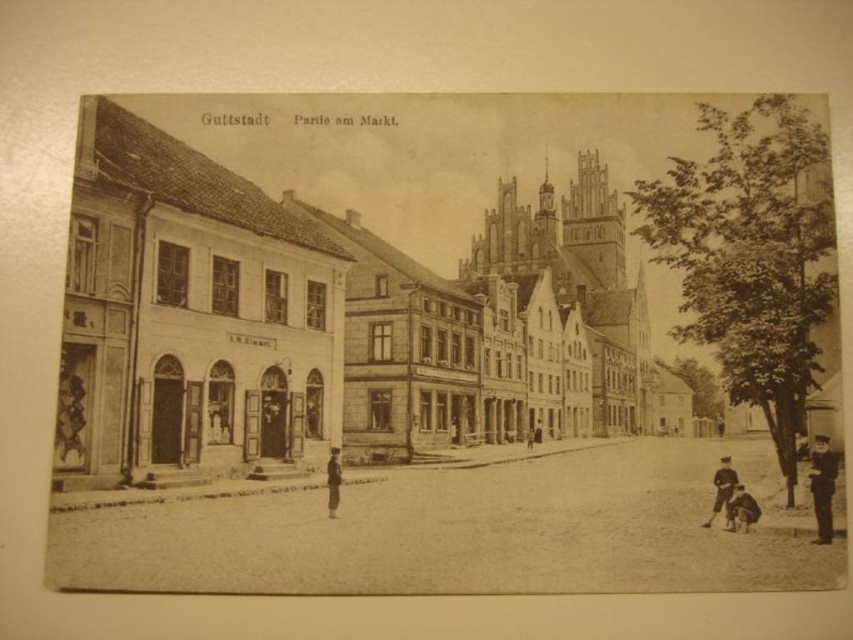
Question: Which object is farther from the camera taking this photo?

Choices:
 (A) dark brown leather jacket at lower right
 (B) dark brown leather hat at lower right
 (C) uniformed man at right
 (D) stone church at center

Answer: (A)

Question: Does dark brown leather jacket at lower right appear on the left side of dark brown uniform at center?

Choices:
 (A) no
 (B) yes

Answer: (A)

Question: Can you confirm if stone church at center is thinner than dark brown leather jacket at lower right?

Choices:
 (A) no
 (B) yes

Answer: (A)

Question: Among these objects, which one is farthest from the camera?

Choices:
 (A) dark brown uniform at center
 (B) dark brown leather hat at lower right

Answer: (B)

Question: Is the position of uniformed man at right more distant than that of dark brown leather jacket at lower right?

Choices:
 (A) no
 (B) yes

Answer: (A)

Question: Which point is closer to the camera?

Choices:
 (A) (827, 532)
 (B) (339, 476)
 (C) (721, 476)
 (D) (680, 113)

Answer: (A)